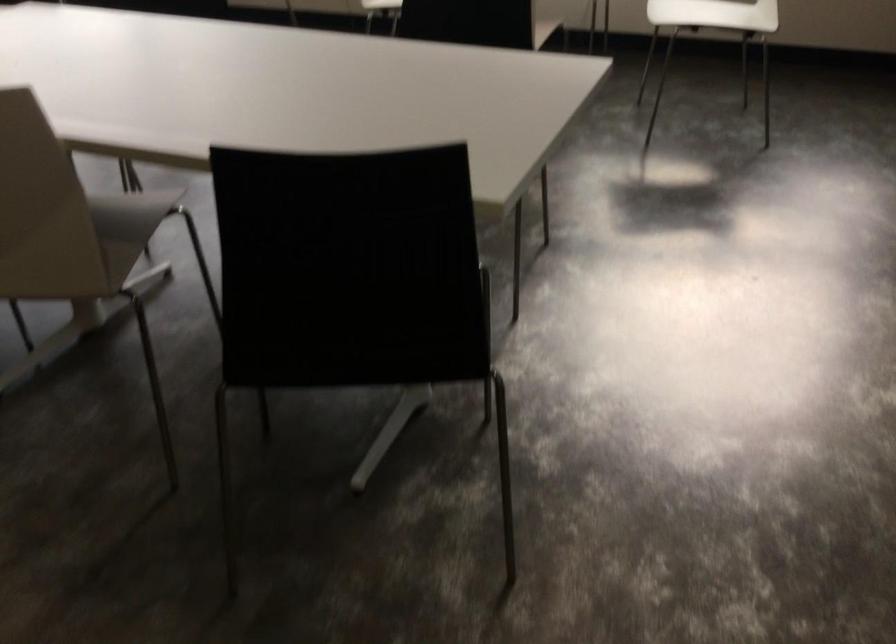
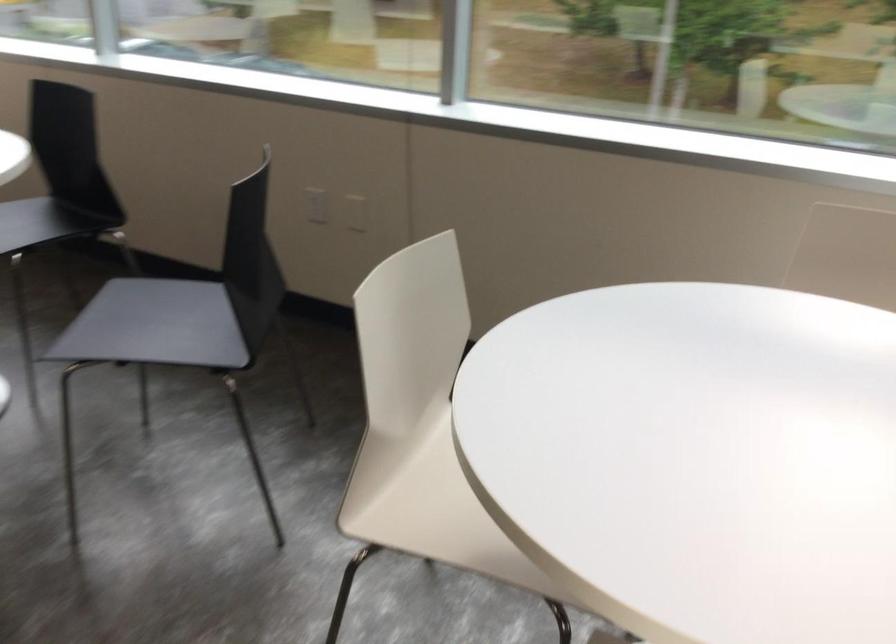
Question: Which direction would the cameraman need to move to produce the second image? Reply with the corresponding letter.

Choices:
 (A) Left
 (B) Right
 (C) Forward
 (D) Backward

Answer: (C)